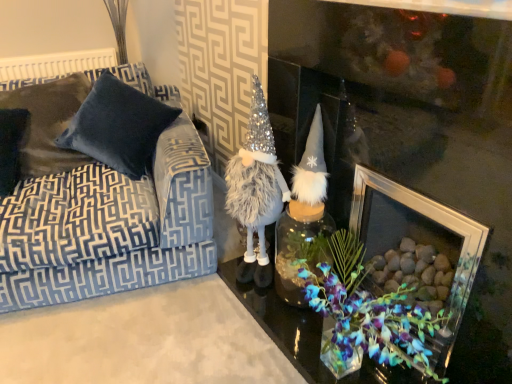
This screenshot has height=384, width=512. In order to click on free space to the left of translucent glass jar at center in this screenshot , I will do `click(239, 314)`.